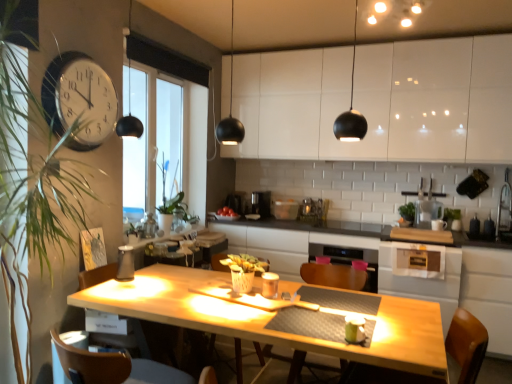
Question: Is transparent plastic pitcher at upper right, the second appliance ordered from the bottom, looking in the opposite direction of white glossy cabinets at upper center?

Choices:
 (A) yes
 (B) no

Answer: (B)

Question: Considering the relative sizes of transparent plastic pitcher at upper right, which is the 1th appliance in back-to-front order, and white glossy cabinets at upper center in the image provided, is transparent plastic pitcher at upper right, which is the 1th appliance in back-to-front order, wider than white glossy cabinets at upper center?

Choices:
 (A) no
 (B) yes

Answer: (A)

Question: Is transparent plastic pitcher at upper right, the second appliance ordered from the bottom, positioned beyond the bounds of white glossy cabinets at upper center?

Choices:
 (A) no
 (B) yes

Answer: (B)

Question: From the image's perspective, is transparent plastic pitcher at upper right, which appears as the second appliance when viewed from the front, above white glossy cabinets at upper center?

Choices:
 (A) no
 (B) yes

Answer: (A)

Question: From a real-world perspective, is transparent plastic pitcher at upper right, the second appliance ordered from the bottom, physically above white glossy cabinets at upper center?

Choices:
 (A) yes
 (B) no

Answer: (B)

Question: In terms of width, does green leafy plant at center, placed as the 2th plant when sorted from front to back, look wider or thinner when compared to black plastic coffee machine at center, the 1th coffee machine in the left-to-right sequence?

Choices:
 (A) wide
 (B) thin

Answer: (A)

Question: From the image's perspective, relative to black plastic coffee machine at center, the second coffee machine positioned from the right, is green leafy plant at center, positioned as the first plant in back-to-front order, above or below?

Choices:
 (A) below
 (B) above

Answer: (B)

Question: Considering the positions of green leafy plant at center, positioned as the first plant in back-to-front order, and black plastic coffee machine at center, the 1th coffee machine in the left-to-right sequence, in the image, is green leafy plant at center, positioned as the first plant in back-to-front order, bigger or smaller than black plastic coffee machine at center, the 1th coffee machine in the left-to-right sequence,?

Choices:
 (A) small
 (B) big

Answer: (B)

Question: Which is correct: green leafy plant at center, positioned as the first plant in back-to-front order, is inside black plastic coffee machine at center, the second coffee machine positioned from the right, or outside of it?

Choices:
 (A) inside
 (B) outside

Answer: (B)

Question: From a real-world perspective, relative to black plastic coffee machine at center, the second coffee machine viewed from the left, is brown wood chair at lower left, marked as the 2th chair in a right-to-left arrangement, vertically above or below?

Choices:
 (A) below
 (B) above

Answer: (A)

Question: Is brown wood chair at lower left, marked as the 2th chair in a right-to-left arrangement, situated inside black plastic coffee machine at center, which is the 1th coffee machine in right-to-left order, or outside?

Choices:
 (A) outside
 (B) inside

Answer: (A)

Question: Does point click(x=125, y=365) appear closer or farther from the camera than point click(x=259, y=203)?

Choices:
 (A) farther
 (B) closer

Answer: (B)

Question: In terms of height, does brown wood chair at lower left, which ranks as the first chair in left-to-right order, look taller or shorter compared to black plastic coffee machine at center, which is the 1th coffee machine in right-to-left order?

Choices:
 (A) short
 (B) tall

Answer: (B)

Question: From a real-world perspective, is black plastic coffee machine at center, which is the 1th coffee machine in right-to-left order, physically located above or below brown wood chair at lower left, marked as the 2th chair in a right-to-left arrangement?

Choices:
 (A) above
 (B) below

Answer: (A)

Question: Considering the relative positions of black plastic coffee machine at center, the second coffee machine viewed from the left, and brown wood chair at lower left, which ranks as the first chair in left-to-right order, in the image provided, is black plastic coffee machine at center, the second coffee machine viewed from the left, to the left or to the right of brown wood chair at lower left, which ranks as the first chair in left-to-right order,?

Choices:
 (A) right
 (B) left

Answer: (A)